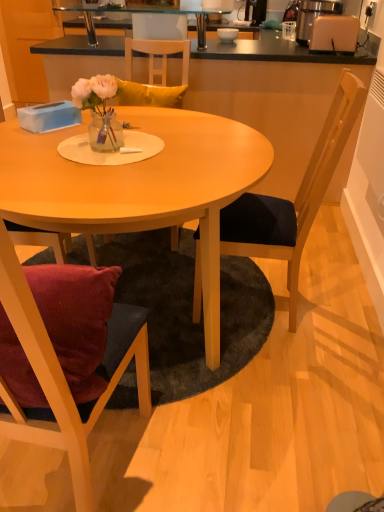
Image resolution: width=384 pixels, height=512 pixels. In order to click on matte wood table at center in this screenshot , I will do `click(138, 185)`.

Describe the element at coordinates (138, 185) in the screenshot. This screenshot has width=384, height=512. I see `matte wood table at center` at that location.

The width and height of the screenshot is (384, 512). Identify the location of beige plastic toaster at upper right. (313, 16).

Measure the distance between wooden chair at left, marked as the 1th chair in a left-to-right arrangement, and camera.

wooden chair at left, marked as the 1th chair in a left-to-right arrangement, is 52.35 centimeters from camera.

Measure the distance between transparent glass table at upper center and camera.

transparent glass table at upper center is 8.81 feet from camera.

Based on the photo, measure the distance between point (104, 116) and camera.

They are 1.48 meters apart.

What do you see at coordinates (274, 95) in the screenshot? I see `smooth black countertop at upper center` at bounding box center [274, 95].

Find the location of a particular element. smooth black countertop at upper center is located at coordinates (274, 95).

This screenshot has height=512, width=384. I want to click on wooden chair at upper center, so click(159, 26).

Considering the relative sizes of black glass shelf at upper center and smooth black countertop at upper center in the image provided, is black glass shelf at upper center bigger than smooth black countertop at upper center?

No.

Is black glass shelf at upper center at the right side of smooth black countertop at upper center?

No.

Is black glass shelf at upper center further to camera compared to smooth black countertop at upper center?

Yes, it is.

From a real-world perspective, which is physically above, beige plastic toaster at upper right or white plastic toaster at upper right?

beige plastic toaster at upper right is physically above.

The width and height of the screenshot is (384, 512). I want to click on toaster lying below the beige plastic toaster at upper right (from the image's perspective), so click(x=334, y=34).

Which is more distant, (307, 13) or (341, 17)?

The point (307, 13) is behind.

Is white plastic toaster at upper right positioned with its back to wooden chair at left, marked as the 1th chair in a left-to-right arrangement?

white plastic toaster at upper right is not turned away from wooden chair at left, marked as the 1th chair in a left-to-right arrangement.

Identify the location of toaster above the wooden chair at left, the 2th chair in the right-to-left sequence (from a real-world perspective). 334,34.

Based on the photo, which of these two, white plastic toaster at upper right or wooden chair at left, marked as the 1th chair in a left-to-right arrangement, is smaller?

white plastic toaster at upper right.

Is white plastic toaster at upper right at the left side of wooden chair at left, marked as the 1th chair in a left-to-right arrangement?

No.

How different are the orientations of smooth black countertop at upper center and white plastic toaster at upper right in degrees?

There is a 84.1-degree angle between the facing directions of smooth black countertop at upper center and white plastic toaster at upper right.

Which point is more forward, [327,96] or [348,44]?

Point [348,44]

Is smooth black countertop at upper center far away from white plastic toaster at upper right?

That's not correct — smooth black countertop at upper center is a little close to white plastic toaster at upper right.

Is smooth black countertop at upper center turned away from white plastic toaster at upper right?

No, smooth black countertop at upper center is not facing the opposite direction of white plastic toaster at upper right.

Are smooth black countertop at upper center and wooden chair at left, marked as the 1th chair in a left-to-right arrangement, making contact?

smooth black countertop at upper center is not next to wooden chair at left, marked as the 1th chair in a left-to-right arrangement, and they're not touching.

Looking at the image, does smooth black countertop at upper center seem bigger or smaller compared to wooden chair at left, the 2th chair in the right-to-left sequence?

Clearly, smooth black countertop at upper center is larger in size than wooden chair at left, the 2th chair in the right-to-left sequence.

Which object is further away from the camera, smooth black countertop at upper center or wooden chair at left, the 2th chair in the right-to-left sequence?

smooth black countertop at upper center is behind.

Is smooth black countertop at upper center taller than wooden chair at left, the 2th chair in the right-to-left sequence?

No.

Is the surface of black glass shelf at upper center in direct contact with translucent glass vase at center?

No, black glass shelf at upper center is not making contact with translucent glass vase at center.

From the image's perspective, relative to translucent glass vase at center, is black glass shelf at upper center above or below?

From the image's perspective, black glass shelf at upper center appears above translucent glass vase at center.

Who is bigger, black glass shelf at upper center or translucent glass vase at center?

black glass shelf at upper center is bigger.

From a real-world perspective, which is physically below, white plastic toaster at upper right or matte white bowl at upper center?

From a 3D spatial view, matte white bowl at upper center is below.

Is white plastic toaster at upper right bigger or smaller than matte white bowl at upper center?

Considering their sizes, white plastic toaster at upper right takes up more space than matte white bowl at upper center.

Does white plastic toaster at upper right have a greater height compared to matte white bowl at upper center?

Yes.

From the image's perspective, which one is positioned higher, white plastic toaster at upper right or matte white bowl at upper center?

matte white bowl at upper center appears higher in the image.

Identify the location of counter top below the black glass shelf at upper center (from the image's perspective). The width and height of the screenshot is (384, 512). (274, 95).

Locate an element on the screen. The width and height of the screenshot is (384, 512). toaster in front of the beige plastic toaster at upper right is located at coordinates (334, 34).

Looking at the image, which one is located further to transparent glass table at upper center, translucent glass vase at center or wooden chair at left, marked as the 1th chair in a left-to-right arrangement?

wooden chair at left, marked as the 1th chair in a left-to-right arrangement.

Consider the image. Based on their spatial positions, is matte white bowl at upper center or wooden chair at left, the 2th chair in the right-to-left sequence, closer to beige plastic toaster at upper right?

matte white bowl at upper center is closer to beige plastic toaster at upper right.

Looking at the image, which one is located closer to black fabric chair at right, which appears as the first chair when viewed from the right, white plastic toaster at upper right or matte wood table at center?

matte wood table at center is positioned closer to the anchor black fabric chair at right, which appears as the first chair when viewed from the right.

Which object lies further to the anchor point wooden chair at left, marked as the 1th chair in a left-to-right arrangement, translucent glass vase at center or smooth black countertop at upper center?

smooth black countertop at upper center lies further to wooden chair at left, marked as the 1th chair in a left-to-right arrangement, than the other object.

Considering their positions, is beige plastic toaster at upper right positioned closer to transparent glass table at upper center than matte wood table at center?

The object closer to transparent glass table at upper center is beige plastic toaster at upper right.

Considering their positions, is white plastic toaster at upper right positioned further to smooth black countertop at upper center than metallic silver coffee machine at upper center?

metallic silver coffee machine at upper center lies further to smooth black countertop at upper center than the other object.

Which object lies nearer to the anchor point black fabric chair at right, the 2th chair viewed from the left, wooden chair at left, marked as the 1th chair in a left-to-right arrangement, or beige plastic toaster at upper right?

wooden chair at left, marked as the 1th chair in a left-to-right arrangement.

Estimate the real-world distances between objects in this image. Which object is closer to transparent glass table at upper center, black glass shelf at upper center or matte wood table at center?

Among the two, black glass shelf at upper center is located nearer to transparent glass table at upper center.

What are the coordinates of `appliance between wooden chair at left, the 2th chair in the right-to-left sequence, and matte white bowl at upper center from front to back` in the screenshot? It's located at (313, 16).

This screenshot has width=384, height=512. I want to click on desk between wooden chair at left, marked as the 1th chair in a left-to-right arrangement, and black fabric chair at right, the 2th chair viewed from the left, from front to back, so click(x=138, y=185).

What are the coordinates of `floral arrangement between matte wood table at center and wooden chair at upper center in the front-back direction` in the screenshot? It's located at (99, 111).

Image resolution: width=384 pixels, height=512 pixels. Find the location of `appliance between black fabric chair at right, which appears as the first chair when viewed from the right, and black glass shelf at upper center from front to back`. appliance between black fabric chair at right, which appears as the first chair when viewed from the right, and black glass shelf at upper center from front to back is located at coordinates [x=313, y=16].